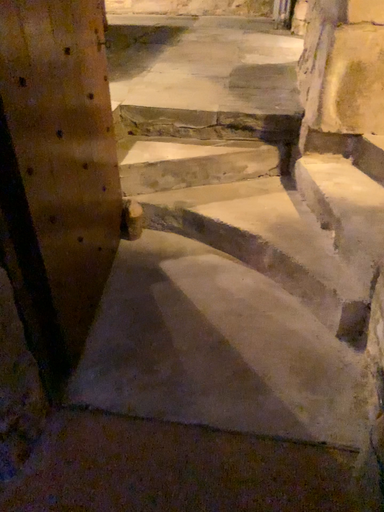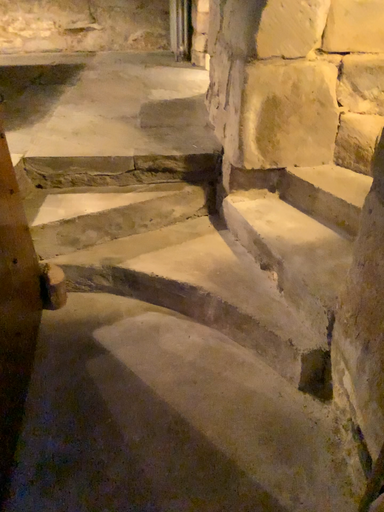
Question: Which way did the camera rotate in the video?

Choices:
 (A) rotated left
 (B) rotated right

Answer: (B)